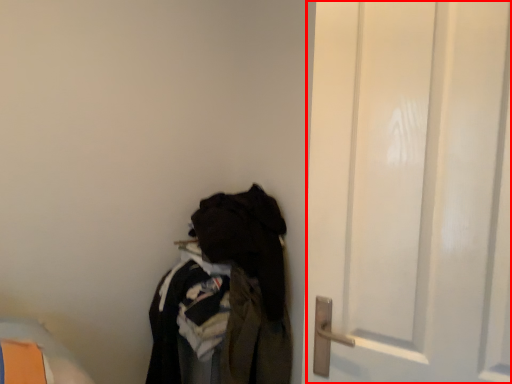
Question: In this image, where is door (annotated by the red box) located relative to closet?

Choices:
 (A) right
 (B) left

Answer: (A)